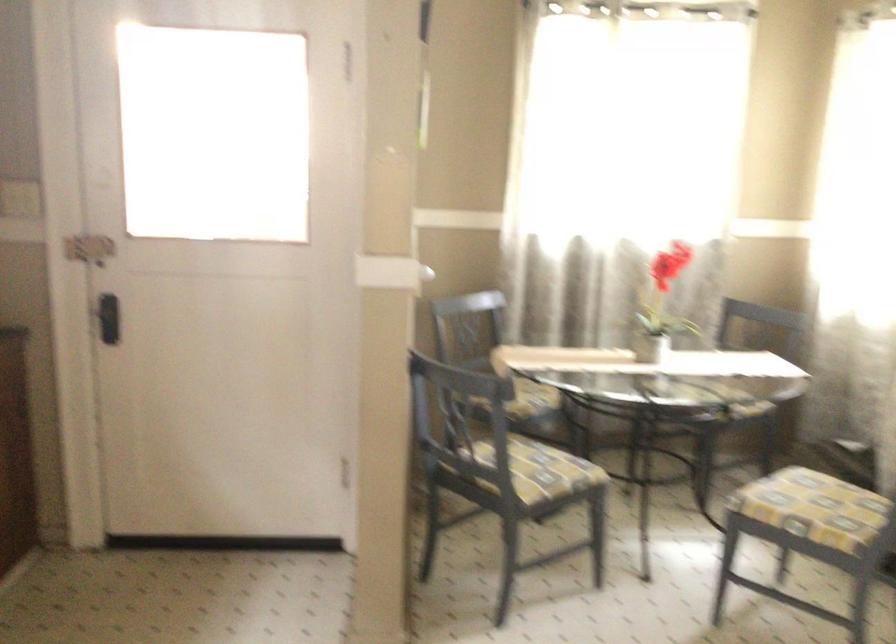
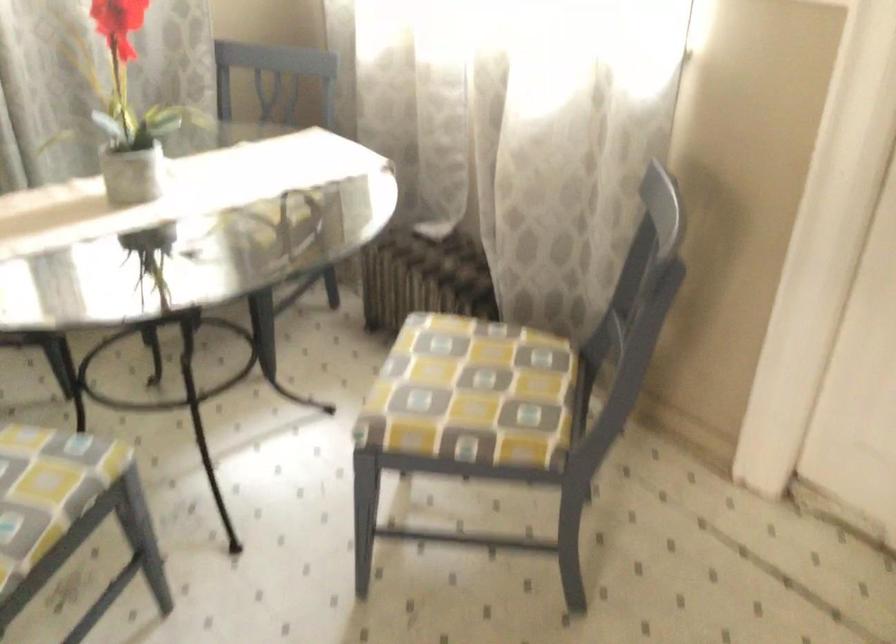
Find the pixel in the second image that matches point (543, 462) in the first image.

(46, 483)